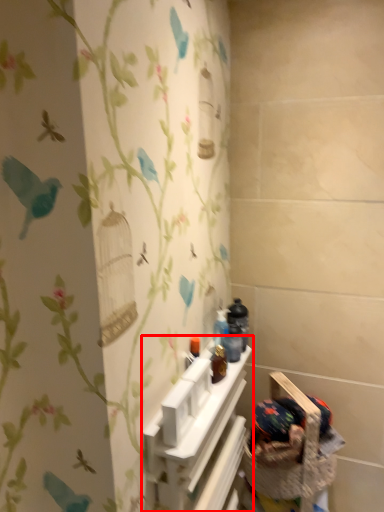
Question: From the image's perspective, what is the correct spatial positioning of shelf (annotated by the red box) in reference to basket container?

Choices:
 (A) above
 (B) below

Answer: (B)